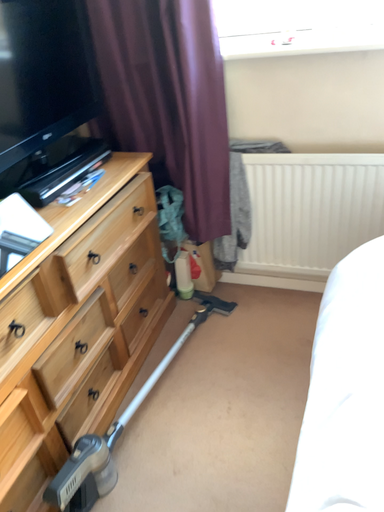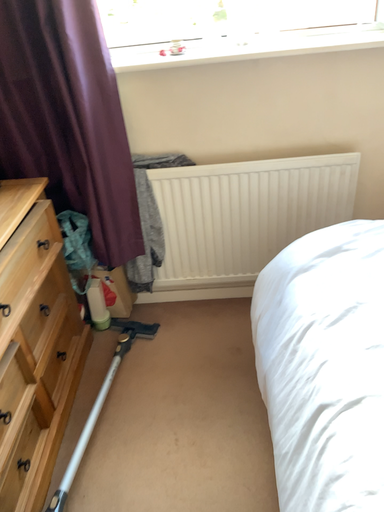
Question: How did the camera likely rotate when shooting the video?

Choices:
 (A) rotated right
 (B) rotated left

Answer: (A)